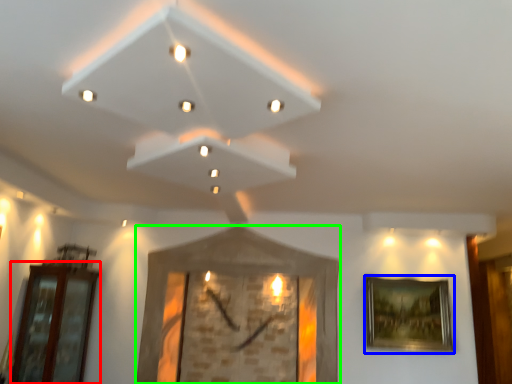
Question: Which object is positioned farthest from glass door (highlighted by a red box)? Select from picture frame (highlighted by a blue box) and picture frame (highlighted by a green box).

Choices:
 (A) picture frame
 (B) picture frame

Answer: (A)